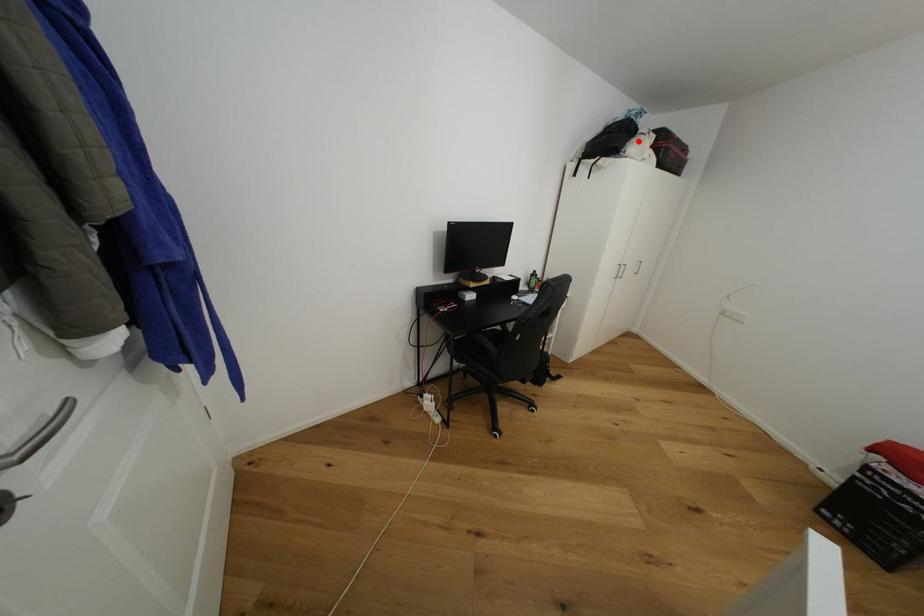
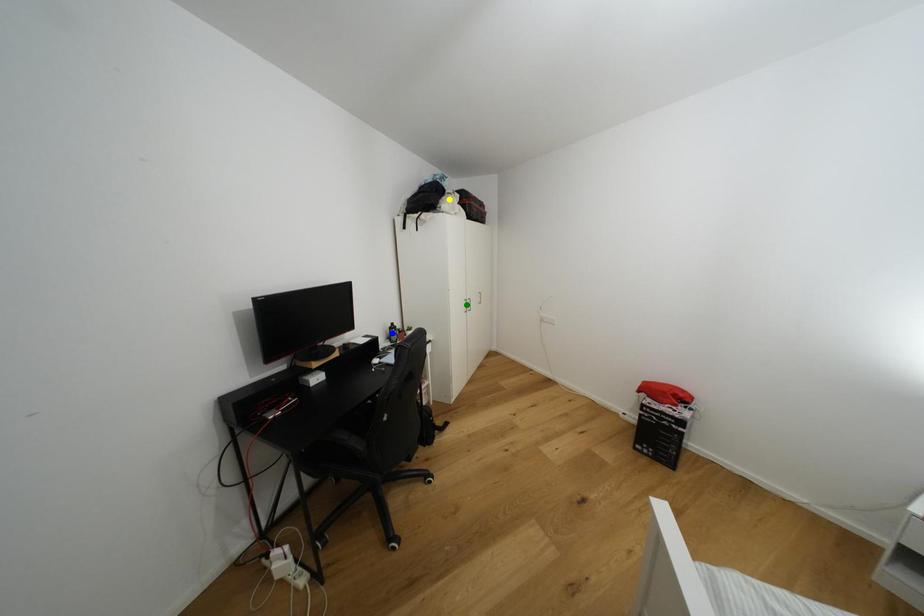
Question: I am providing you with two images of the same scene from different viewpoints. A red point is marked on the first image. You are given multiple points on the second image. Which point in image 2 represents the same 3d spot as the red point in image 1?

Choices:
 (A) blue point
 (B) green point
 (C) yellow point

Answer: (C)